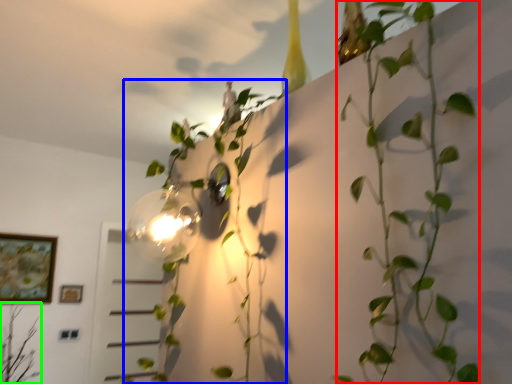
Question: Based on their relative distances, which object is nearer to plant (highlighted by a red box)? Choose from plant (highlighted by a blue box) and plant (highlighted by a green box).

Choices:
 (A) plant
 (B) plant

Answer: (A)